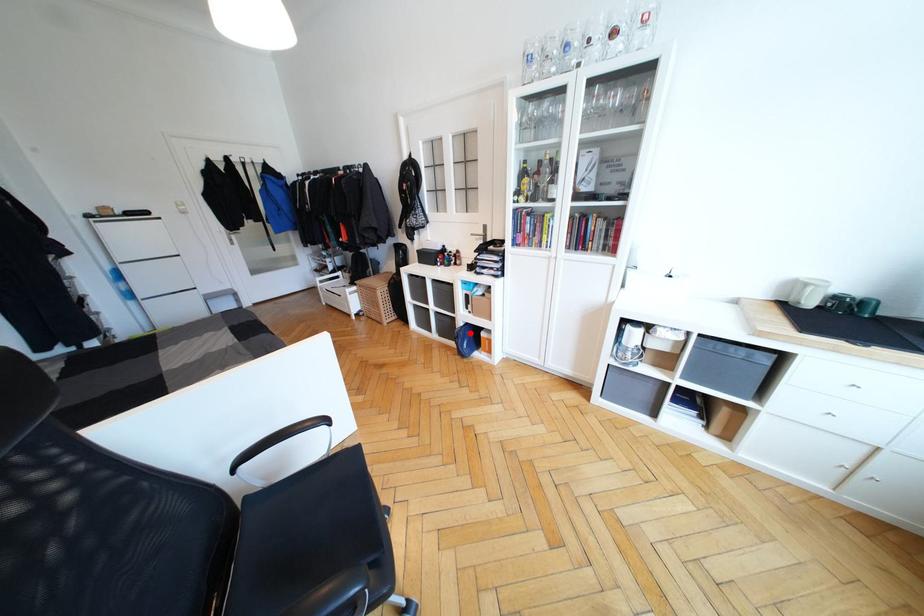
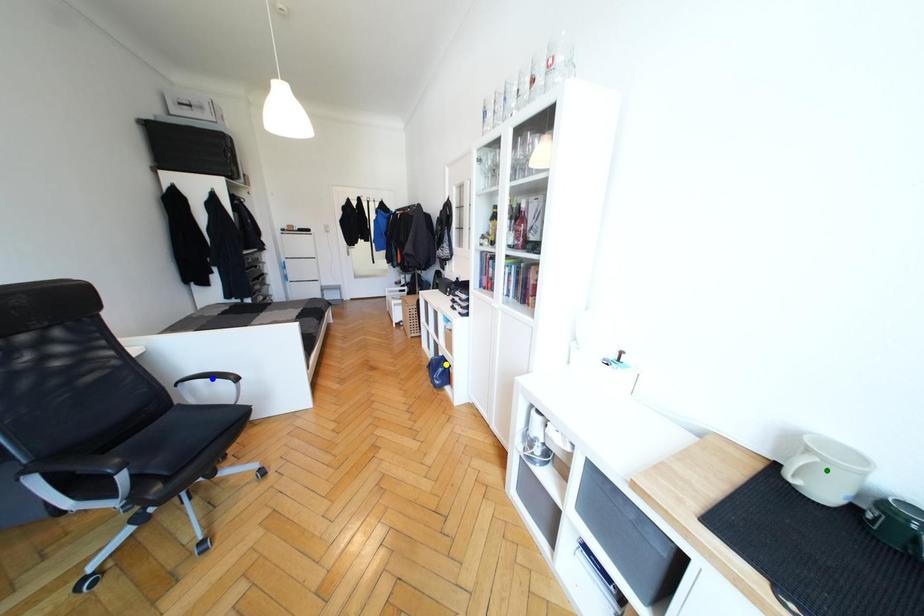
Question: I am providing you with two images of the same scene from different viewpoints. A red point is marked on the first image. You are given multiple points on the second image. Which spot in image 2 lines up with the point in image 1?

Choices:
 (A) green point
 (B) blue point
 (C) yellow point

Answer: (C)